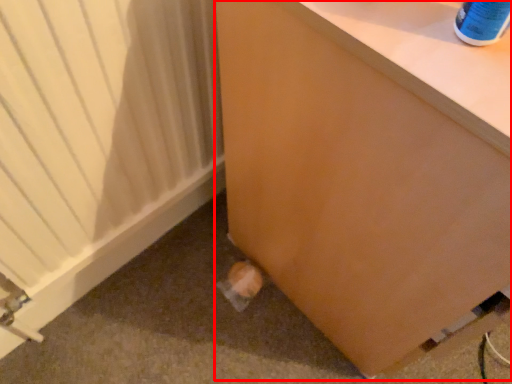
Question: From the image's perspective, considering the relative positions of furniture (annotated by the red box) and heater in the image provided, where is furniture (annotated by the red box) located with respect to the staircase?

Choices:
 (A) below
 (B) above

Answer: (B)